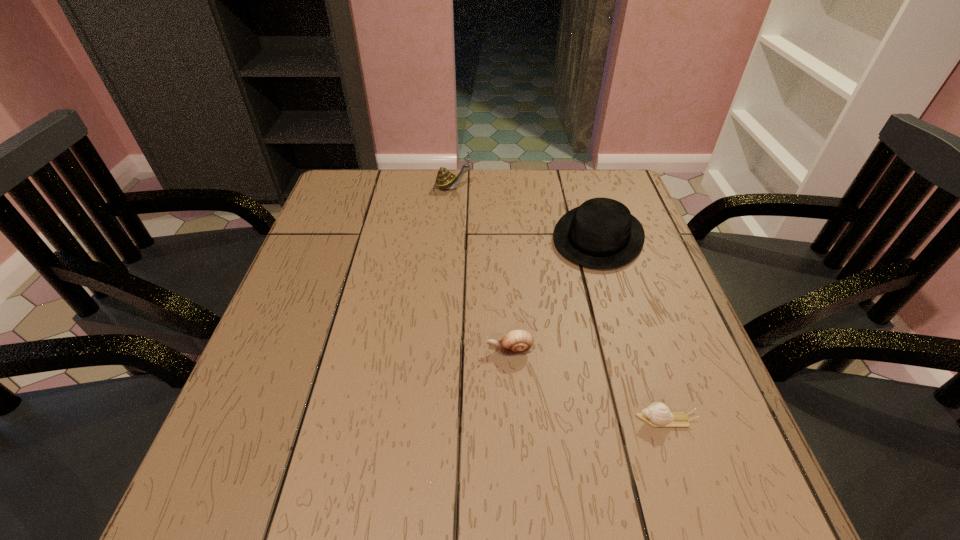
In order to click on vacant space in between the third nearest object and the second nearest object in this screenshot , I will do `click(554, 294)`.

Locate an element on the screen. This screenshot has height=540, width=960. free spot between the second tallest object and the tallest object is located at coordinates (525, 212).

Locate an element on the screen. The height and width of the screenshot is (540, 960). free space that is in between the shortest object and the second farthest object is located at coordinates (632, 329).

This screenshot has height=540, width=960. I want to click on free space that is in between the nearest escargot and the leftmost escargot, so tap(559, 303).

Where is `empty space between the nearest escargot and the third shortest object`? The image size is (960, 540). empty space between the nearest escargot and the third shortest object is located at coordinates (632, 329).

Image resolution: width=960 pixels, height=540 pixels. Find the location of `vacant space that's between the fedora and the third farthest object`. vacant space that's between the fedora and the third farthest object is located at coordinates (554, 294).

This screenshot has width=960, height=540. Identify the location of object that stands as the closest to the shortest escargot. (517, 342).

Identify which object is the second nearest to the second tallest object. Please provide its 2D coordinates. Your answer should be formatted as a tuple, i.e. [(x, y)], where the tuple contains the x and y coordinates of a point satisfying the conditions above.

[(517, 342)]

Locate which escargot ranks in proximity to the shortest object. Please provide its 2D coordinates. Your answer should be formatted as a tuple, i.e. [(x, y)], where the tuple contains the x and y coordinates of a point satisfying the conditions above.

[(517, 342)]

Select which escargot appears as the closest to the nearest object. Please provide its 2D coordinates. Your answer should be formatted as a tuple, i.e. [(x, y)], where the tuple contains the x and y coordinates of a point satisfying the conditions above.

[(517, 342)]